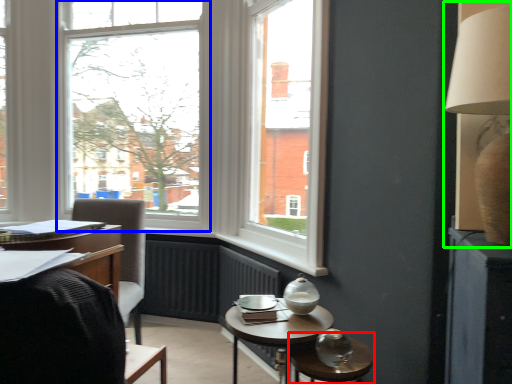
Question: Estimate the real-world distances between objects in this image. Which object is farther from glass table (highlighted by a red box), window (highlighted by a blue box) or table lamp (highlighted by a green box)?

Choices:
 (A) window
 (B) table lamp

Answer: (A)